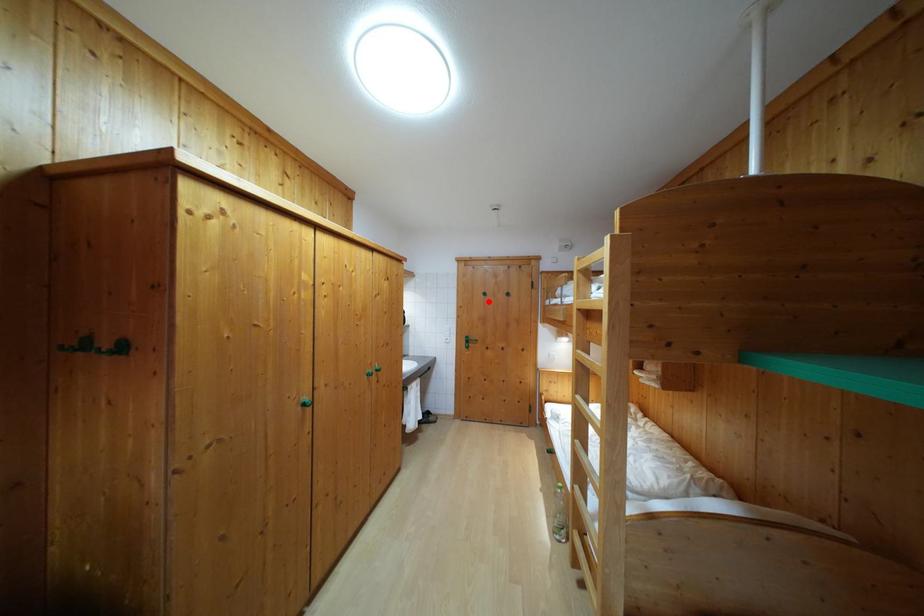
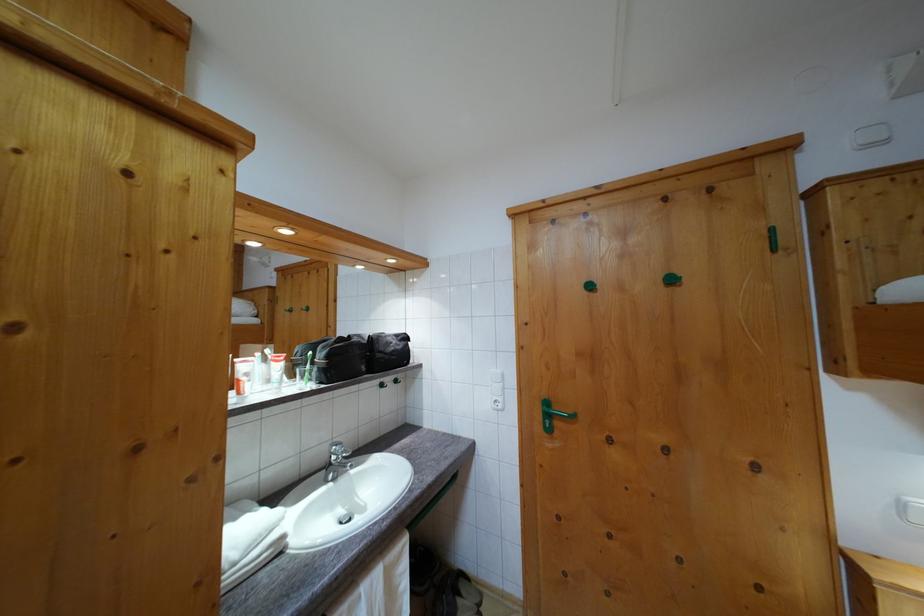
Where in the second image is the point corresponding to the highlighted location from the first image?

(593, 294)